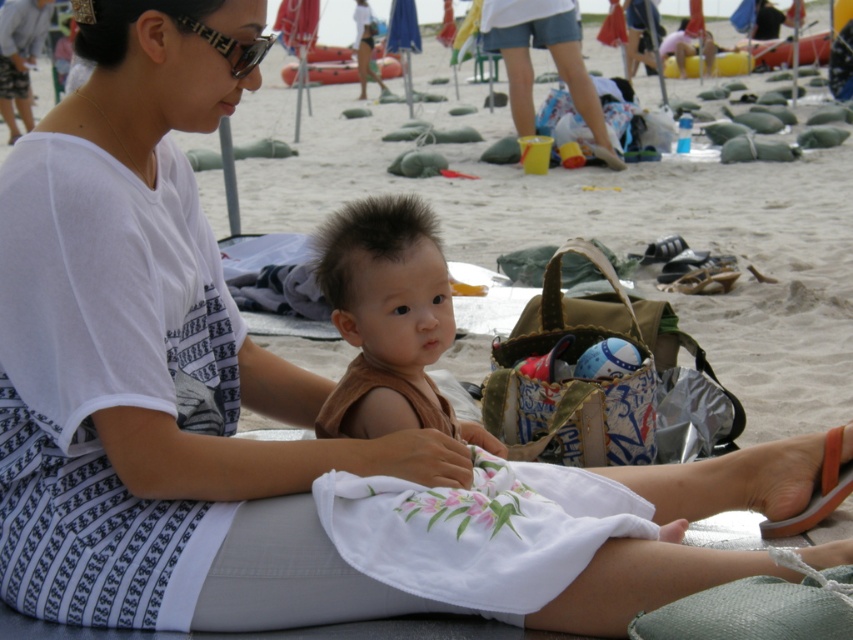
Question: From the image, what is the correct spatial relationship of brown cotton shirt at center in relation to white cotton dress at center?

Choices:
 (A) below
 (B) above

Answer: (A)

Question: Among these objects, which one is nearest to the camera?

Choices:
 (A) orange rubber sandal at lower right
 (B) brown cotton shirt at center

Answer: (B)

Question: Which of the following is the farthest from the observer?

Choices:
 (A) orange rubber sandal at lower right
 (B) brown cotton shirt at center
 (C) white cotton dress at center

Answer: (C)

Question: Which object is the closest to the brown cotton shirt at center?

Choices:
 (A) orange rubber sandal at lower right
 (B) white cotton dress at center

Answer: (A)

Question: Does white cotton dress at center lie in front of orange rubber sandal at lower right?

Choices:
 (A) no
 (B) yes

Answer: (A)

Question: Does brown cotton shirt at center appear over white cotton dress at center?

Choices:
 (A) no
 (B) yes

Answer: (A)